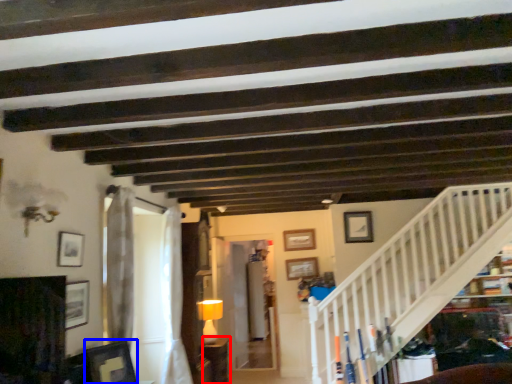
Question: Which point is closer to the camera, furniture (highlighted by a red box) or picture frame (highlighted by a blue box)?

Choices:
 (A) furniture
 (B) picture frame

Answer: (B)